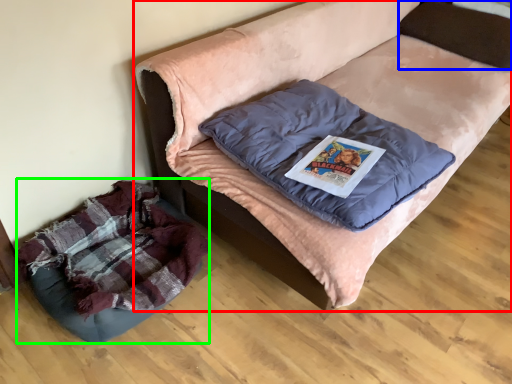
Question: Which object is positioned farthest from furniture (highlighted by a red box)? Select from pillow (highlighted by a blue box) and dog bed (highlighted by a green box).

Choices:
 (A) pillow
 (B) dog bed

Answer: (B)